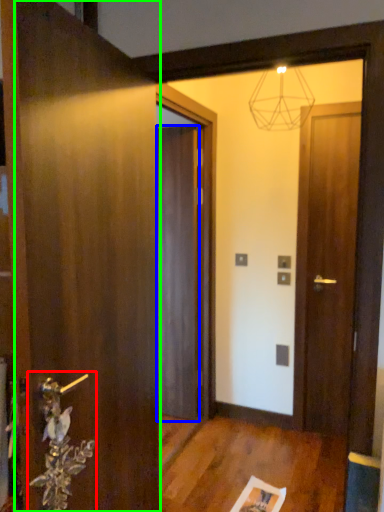
Question: Based on their relative distances, which object is farther from door handle (highlighted by a red box)? Choose from door (highlighted by a blue box) and door (highlighted by a green box).

Choices:
 (A) door
 (B) door

Answer: (A)